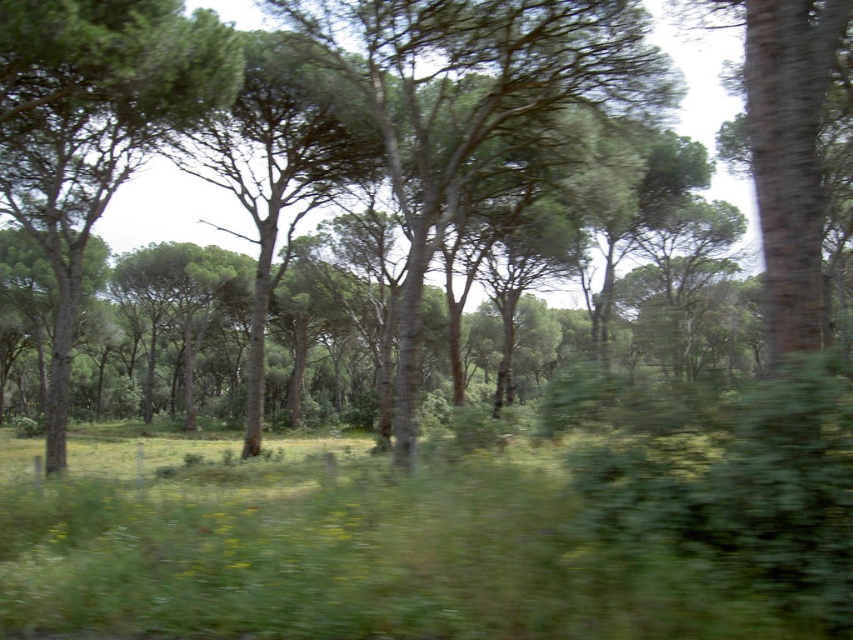
Does green leafy tree at center appear over green rough bark tree at left?

No.

Does point (537, 80) lie in front of point (38, 211)?

Yes, point (537, 80) is in front of point (38, 211).

The height and width of the screenshot is (640, 853). Identify the location of green leafy tree at center. (476, 106).

Which of these two, green leafy grass at center or green leafy tree at center, stands taller?

green leafy tree at center is taller.

Is point (149, 616) positioned after point (503, 3)?

That is False.

At what (x,y) coordinates should I click in order to perform the action: click on green leafy grass at center. Please return your answer as a coordinate pair (x, y). This screenshot has height=640, width=853. Looking at the image, I should click on (341, 548).

Is green leafy grass at center bigger than green rough bark tree at left?

Actually, green leafy grass at center might be smaller than green rough bark tree at left.

Which is above, green leafy grass at center or green rough bark tree at left?

green rough bark tree at left is higher up.

Is point (331, 616) less distant than point (4, 131)?

Yes, point (331, 616) is in front of point (4, 131).

The height and width of the screenshot is (640, 853). Identify the location of green leafy grass at center. (341, 548).